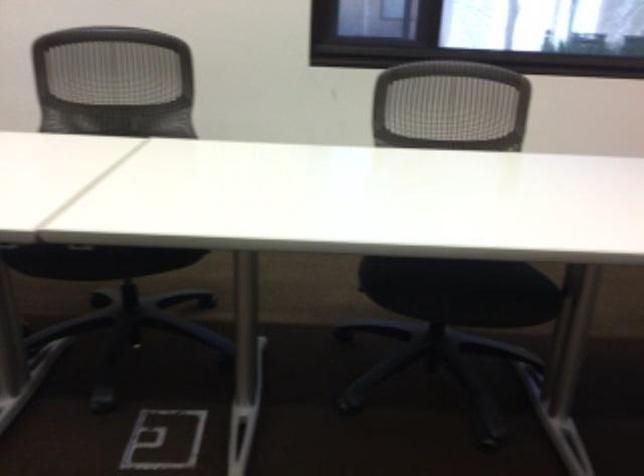
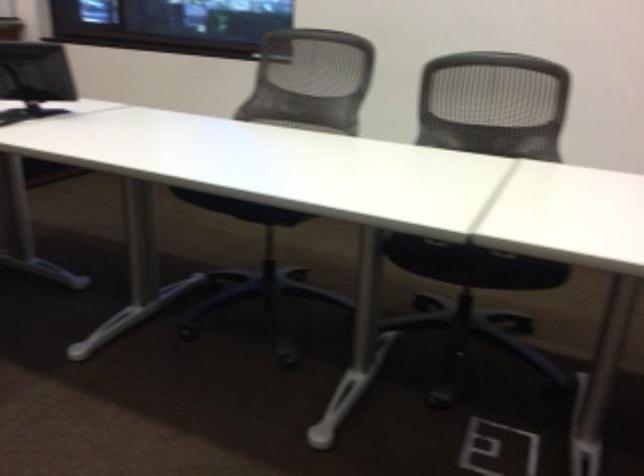
Question: What movement of the cameraman would produce the second image?

Choices:
 (A) Left
 (B) Right
 (C) Forward
 (D) Backward

Answer: (A)